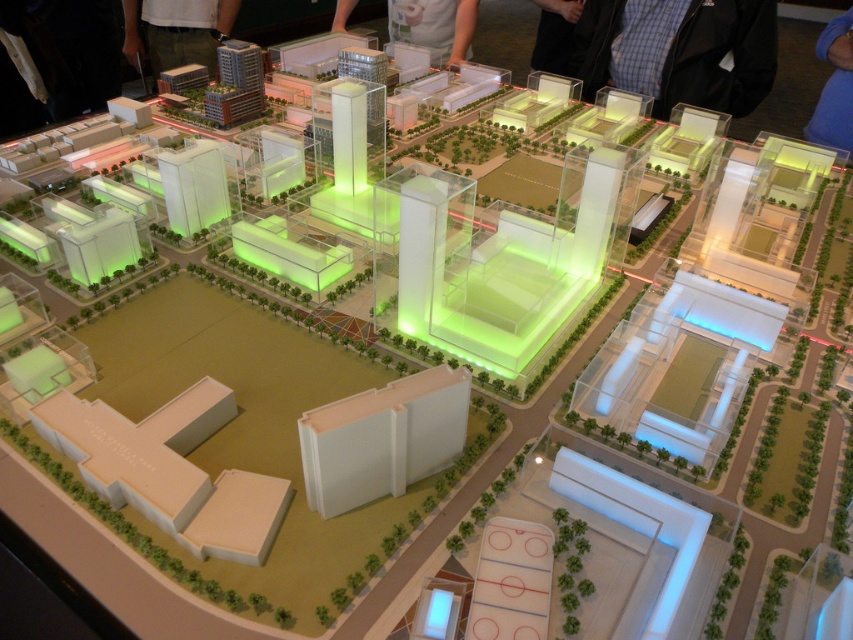
Question: Which object is closer to the camera taking this photo?

Choices:
 (A) blue fabric at upper right
 (B) matte white shirt at upper center
 (C) black fabric pants at upper left

Answer: (A)

Question: Does black fabric pants at upper left appear on the right side of matte white shirt at upper center?

Choices:
 (A) no
 (B) yes

Answer: (A)

Question: Which of these objects is positioned closest to the black fabric pants at upper left?

Choices:
 (A) blue fabric at upper right
 (B) matte white shirt at upper center

Answer: (B)

Question: Which is nearer to the blue fabric at upper right?

Choices:
 (A) black fabric pants at upper left
 (B) matte white shirt at upper center

Answer: (B)

Question: Is black fabric pants at upper left to the left of matte white shirt at upper center from the viewer's perspective?

Choices:
 (A) no
 (B) yes

Answer: (B)

Question: Does black fabric pants at upper left appear over matte white shirt at upper center?

Choices:
 (A) no
 (B) yes

Answer: (B)